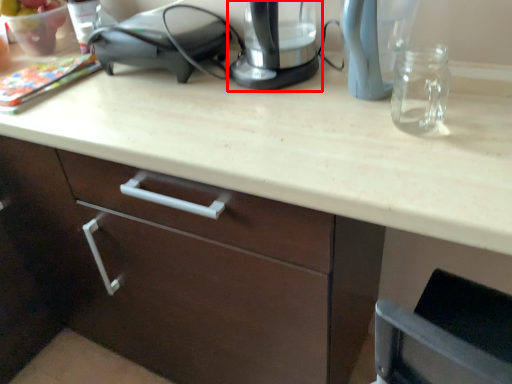
Question: Observing the image, what is the correct spatial positioning of home appliance (annotated by the red box) in reference to appliance?

Choices:
 (A) left
 (B) right

Answer: (B)